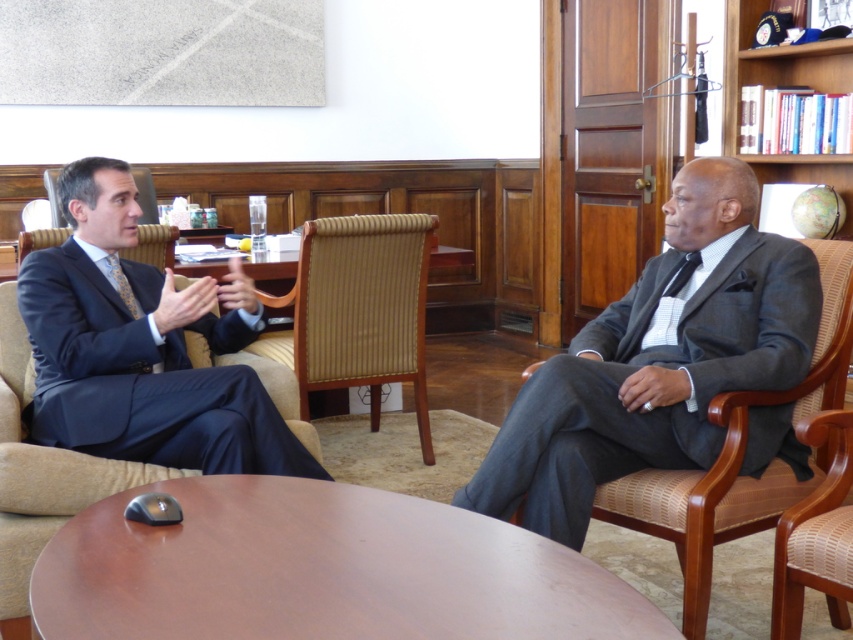
Question: Which object is the farthest from the brown wood round table at center?

Choices:
 (A) matte black suit at left
 (B) brown woven armchair at center
 (C) wooden armchair at right
 (D) gray wool suit at right

Answer: (B)

Question: Is matte black suit at left closer to the viewer compared to wooden armchair at right?

Choices:
 (A) yes
 (B) no

Answer: (B)

Question: Among these points, which one is farthest from the camera?

Choices:
 (A) (367, 608)
 (B) (339, 380)

Answer: (B)

Question: Can you confirm if gray wool suit at right is thinner than brown woven armchair at center?

Choices:
 (A) no
 (B) yes

Answer: (A)

Question: Can you confirm if gray wool suit at right is positioned to the left of wooden armchair at right?

Choices:
 (A) no
 (B) yes

Answer: (B)

Question: Considering the real-world distances, which object is farthest from the gray wool suit at right?

Choices:
 (A) brown woven armchair at center
 (B) wooden bookshelf at upper right
 (C) brown wood round table at center

Answer: (B)